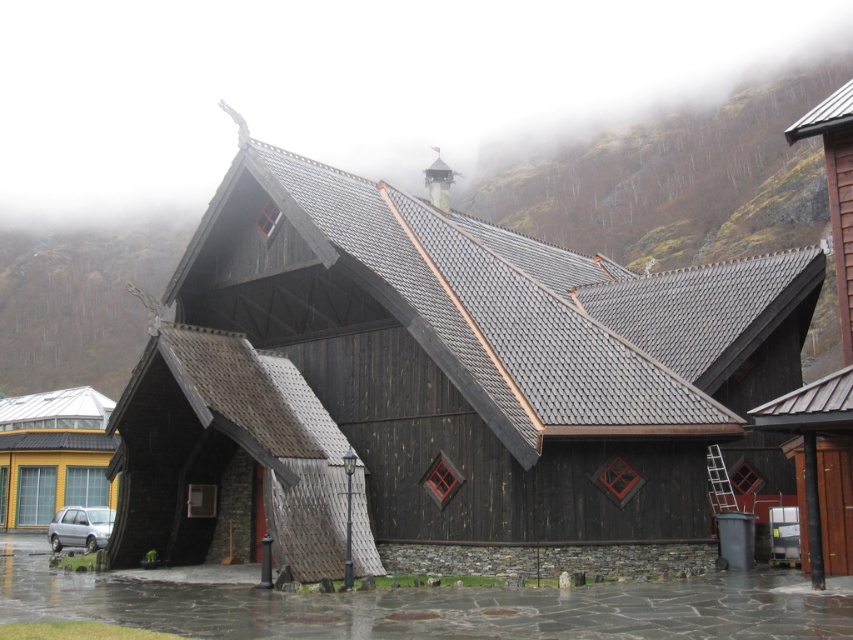
Does dark wood chapel at center appear over silver metallic car at lower left?

Yes.

Is dark wood chapel at center below silver metallic car at lower left?

Actually, dark wood chapel at center is above silver metallic car at lower left.

Who is more forward, (631, 333) or (97, 509)?

Point (631, 333) is in front.

Find the location of a particular element. dark wood chapel at center is located at coordinates (438, 385).